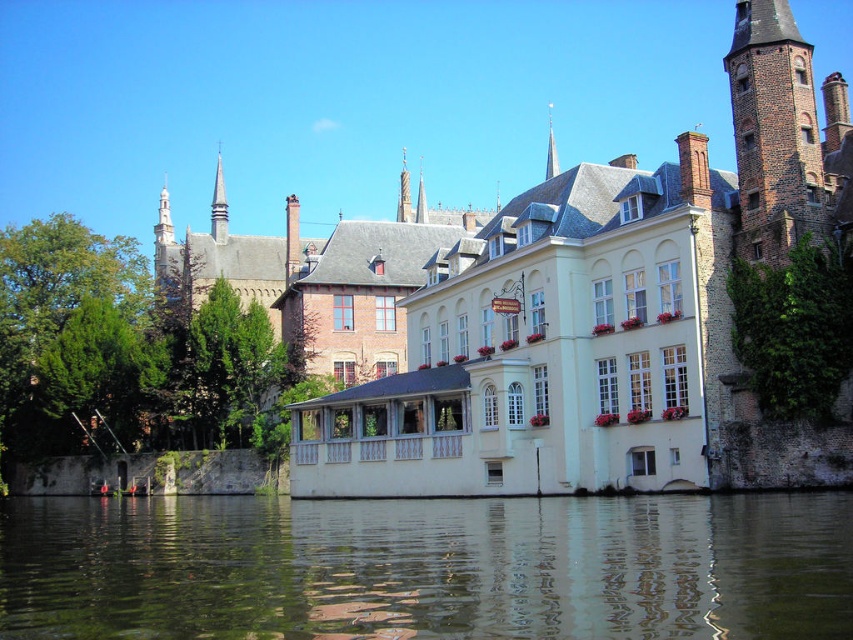
Is white stone building at center smaller than green reflective water at center?

Incorrect, white stone building at center is not smaller in size than green reflective water at center.

Can you confirm if white stone building at center is positioned below green reflective water at center?

No.

Is point (514, 324) farther from camera compared to point (672, 618)?

Yes, it is.

The image size is (853, 640). Identify the location of white stone building at center. (590, 314).

Does white stone building at center appear on the left side of brown brick tower at upper right?

Indeed, white stone building at center is positioned on the left side of brown brick tower at upper right.

Is white stone building at center bigger than brown brick tower at upper right?

Yes, white stone building at center is bigger than brown brick tower at upper right.

Who is more distant from viewer, (577, 227) or (743, 44)?

Point (577, 227)

Locate an element on the screen. white stone building at center is located at coordinates (590, 314).

Which of these two, green reflective water at center or brown brick tower at upper right, stands shorter?

Standing shorter between the two is green reflective water at center.

The image size is (853, 640). What do you see at coordinates (428, 566) in the screenshot?
I see `green reflective water at center` at bounding box center [428, 566].

Is point (322, 602) positioned after point (735, 250)?

That is False.

Where is `green reflective water at center`? green reflective water at center is located at coordinates (428, 566).